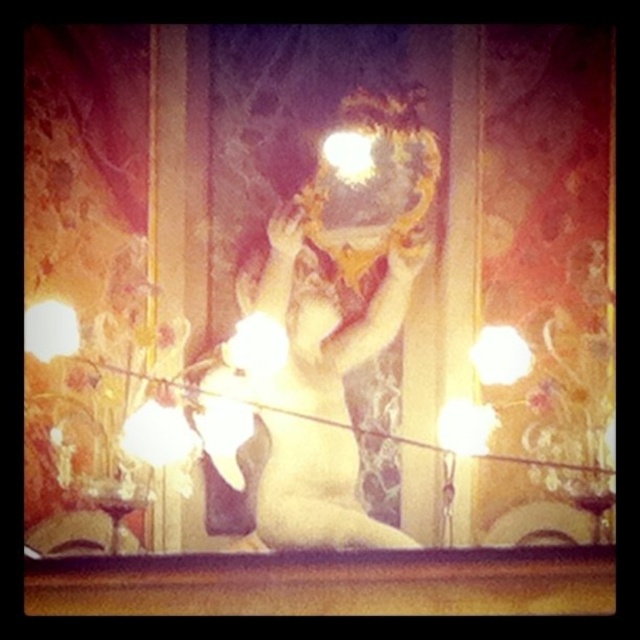
You are an interior designer planning to place a new decorative item in the room. The item is 1 meter wide. You see the smooth gold statue at center and the white satin dress at center. Which object can the new item fit next to without overlapping?

The new decorative item that is 1 meter wide can fit next to the smooth gold statue at center because its width is larger than the white satin dress at center, providing enough space.

You are an interior designer planning to place a new lamp in this room. The lamp has a base that requires a clear space of 1 meter in diameter. Is the area around the smooth gold statue at center suitable for placing the lamp base?

The smooth gold statue at center is located at coordinates point (317,392). Since the lamp base requires a clear space of 1 meter in diameter, it would depend on the total dimensions of the room and the statue. However, the coordinates alone do not provide sufficient information about the available space around the statue to determine suitability.

From the picture: You are an interior designer planning to place a new lamp in the room. The lamp is 1.8 meters tall. Considering the smooth gold statue at center and the white satin dress at center, which object should the lamp be placed next to so it doesn

The smooth gold statue at center is taller than the white satin dress at center. Since the lamp is 1.8 meters tall, it would be more proportionate to place it next to the smooth gold statue at center to maintain visual harmony.